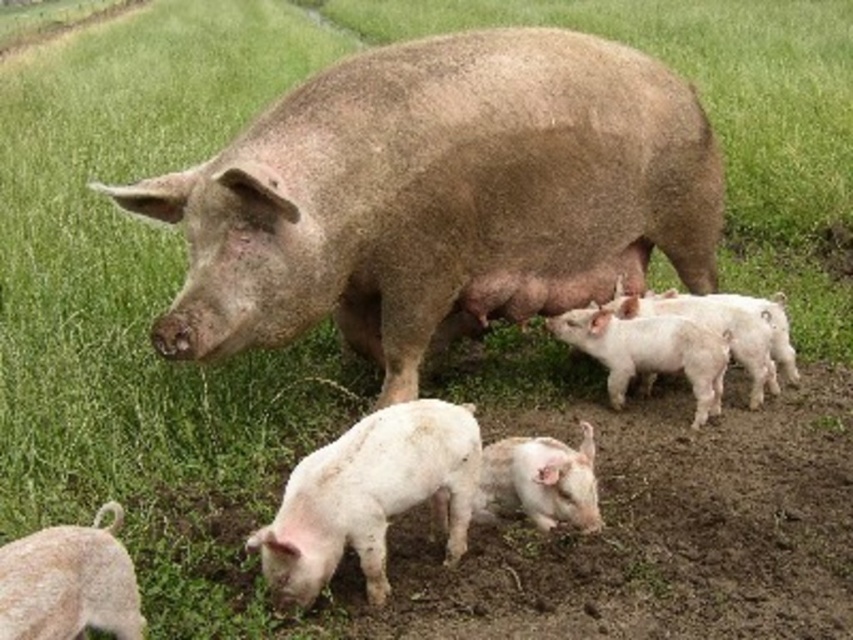
Question: Does white matte piglets at center have a larger size compared to white soft piglet at lower center?

Choices:
 (A) yes
 (B) no

Answer: (A)

Question: Considering the real-world distances, which object is farthest from the white soft piglet at lower center?

Choices:
 (A) white fluffy piglet at lower left
 (B) white matte piglet at lower center

Answer: (A)

Question: Does white matte piglets at center appear under white soft piglet at lower center?

Choices:
 (A) no
 (B) yes

Answer: (A)

Question: Does white fluffy piglet at lower left appear on the left side of white soft piglet at lower center?

Choices:
 (A) no
 (B) yes

Answer: (B)

Question: Which object is the closest to the white matte piglets at center?

Choices:
 (A) brown textured pig at center
 (B) white fluffy piglet at lower left
 (C) white matte piglet at lower center
 (D) white soft piglet at lower center

Answer: (A)

Question: Which point appears farthest from the camera in this image?

Choices:
 (A) (279, 576)
 (B) (698, 344)
 (C) (637, 173)

Answer: (B)